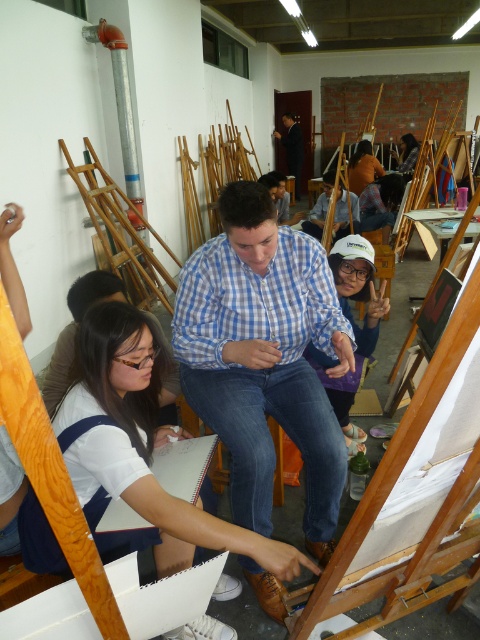
Question: Estimate the real-world distances between objects in this image. Which object is farther from the blue checkered shirt at center?

Choices:
 (A) dark blue shirt at center
 (B) white matte paper at lower left

Answer: (A)

Question: Among these points, which one is nearest to the camera?

Choices:
 (A) (302, 225)
 (B) (295, 164)

Answer: (A)

Question: Does white matte paper at lower left appear under matte brown hair at center?

Choices:
 (A) yes
 (B) no

Answer: (A)

Question: Based on their relative distances, which object is nearer to the dark blue shirt at center?

Choices:
 (A) blue plaid shirt at center
 (B) white matte cap at center
 (C) white matte paper at lower left

Answer: (A)

Question: Can you confirm if matte brown hair at center is thinner than dark blue shirt at center?

Choices:
 (A) no
 (B) yes

Answer: (A)

Question: Does white matte paper at lower left have a smaller size compared to blue plaid shirt at center?

Choices:
 (A) yes
 (B) no

Answer: (A)